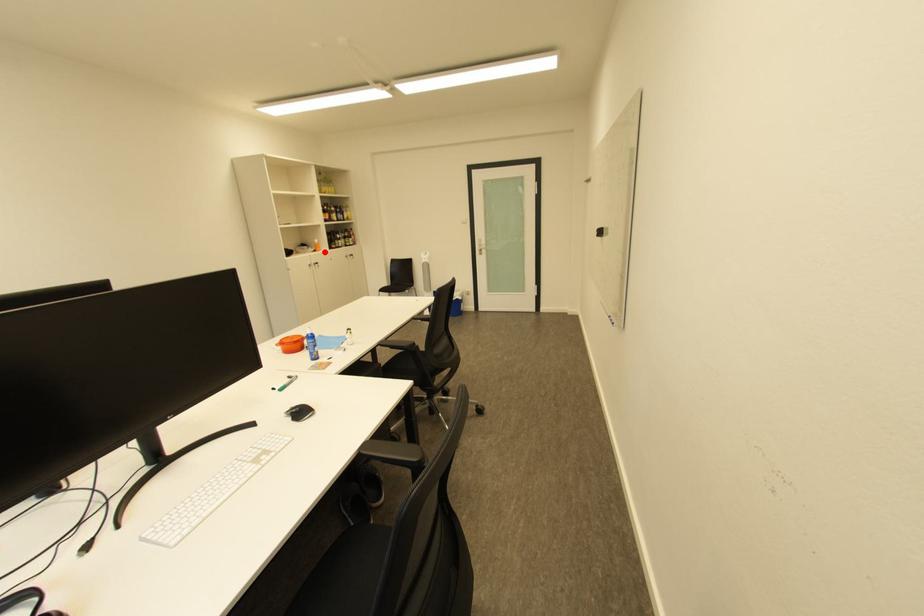
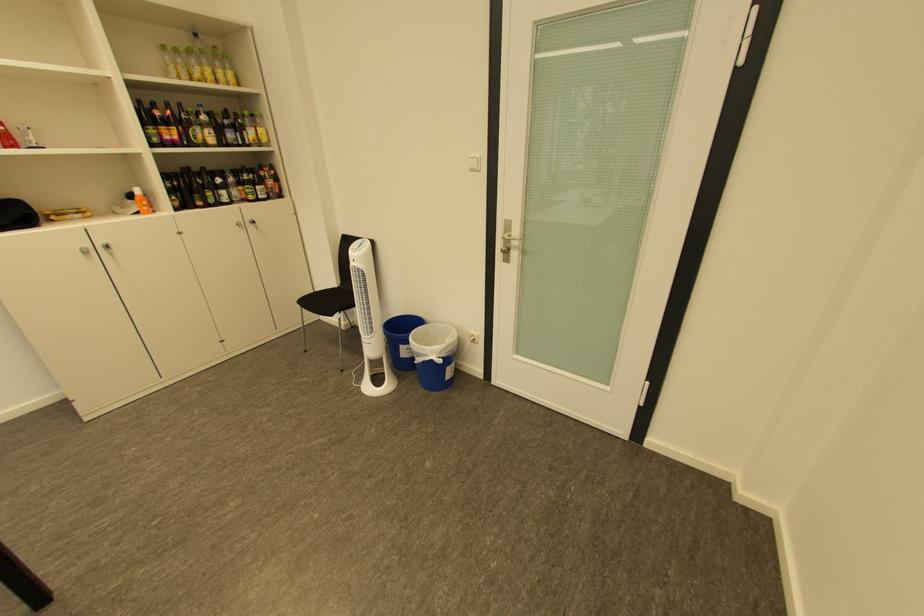
Question: I am providing you with two images of the same scene from different viewpoints. Image1 has a red point marked. In image2, the corresponding 3D location appears at what relative position? Reply with the corresponding letter.

Choices:
 (A) Closer
 (B) Farther

Answer: (B)